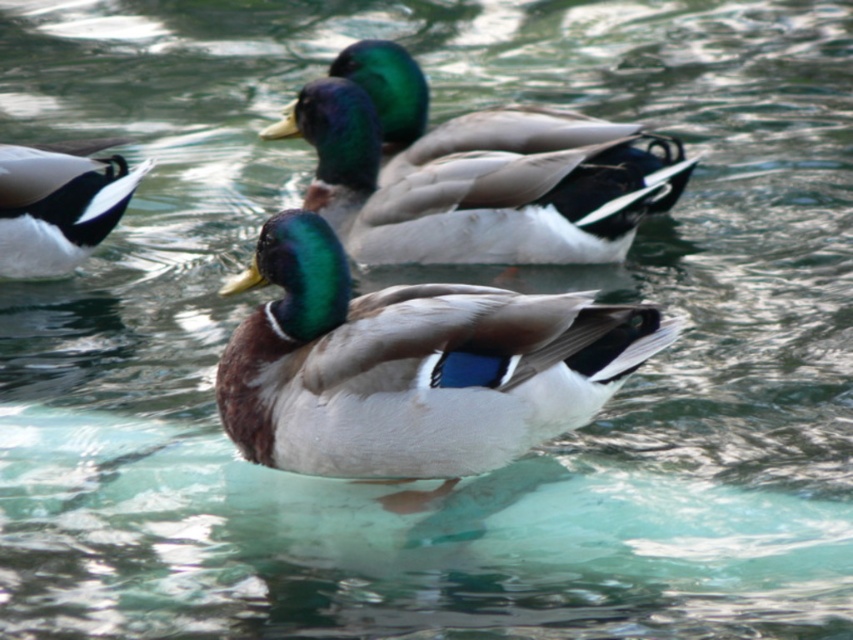
Question: Among these objects, which one is nearest to the camera?

Choices:
 (A) shiny green head at center
 (B) shiny black feathers at left

Answer: (B)

Question: Can you confirm if shiny brown duck at center is thinner than shiny black feathers at left?

Choices:
 (A) no
 (B) yes

Answer: (A)

Question: Is shiny green head at center bigger than shiny black feathers at left?

Choices:
 (A) yes
 (B) no

Answer: (A)

Question: Which is nearer to the shiny brown duck at center?

Choices:
 (A) shiny black feathers at left
 (B) shiny green head at center

Answer: (B)

Question: Can you confirm if shiny brown duck at center is positioned to the right of shiny green head at center?

Choices:
 (A) no
 (B) yes

Answer: (A)

Question: Considering the real-world distances, which object is farthest from the shiny green head at center?

Choices:
 (A) shiny brown duck at center
 (B) shiny black feathers at left

Answer: (A)